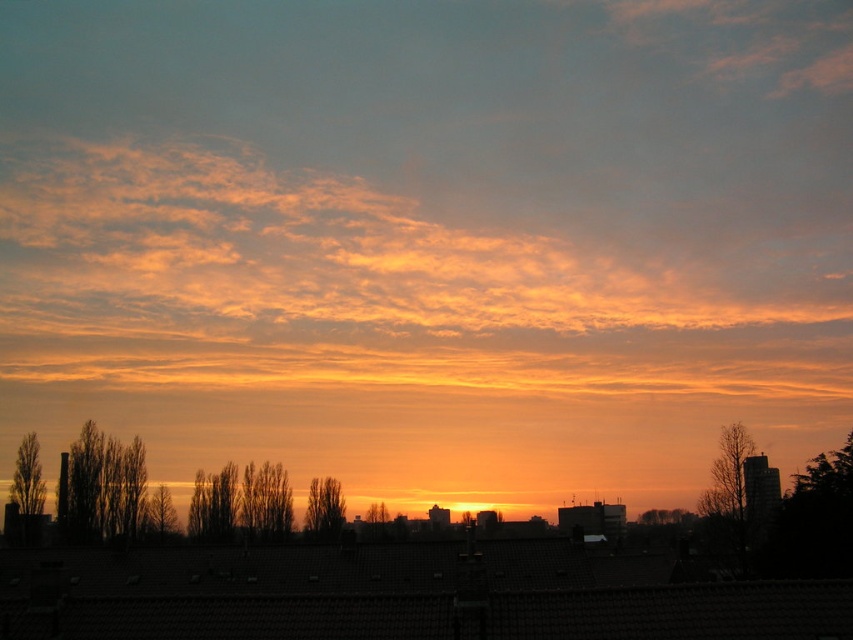
You are a drone operator tasked with flying a drone between the brown textured tree at left and the green matte tree at center. The drone has a maximum flight range of 130 meters. Can you safely fly the drone from one tree to the other without exceeding its range?

The brown textured tree at left and green matte tree at center are 128.89 meters apart from each other. Since the distance is less than the drone maximum flight range of 130 meters, the drone can safely fly between them without exceeding its range.

You are standing in the cityscape scene and notice a point marked at coordinates (x=323, y=509). Based on the description, can you identify what object this point is located on?

The point at coordinates (x=323, y=509) is located on the smooth brown tree at center.